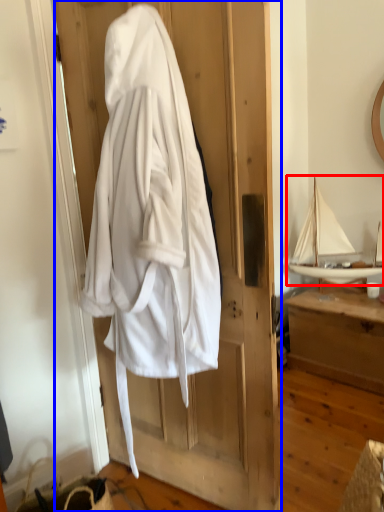
Question: Which object appears closest to the camera in this image, boat (highlighted by a red box) or door (highlighted by a blue box)?

Choices:
 (A) boat
 (B) door

Answer: (B)